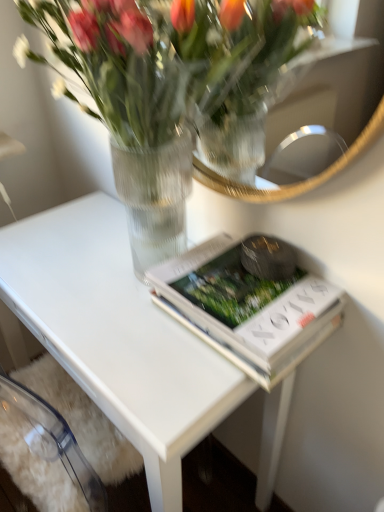
Question: Is white matte book at center outside of clear glass vase at upper center?

Choices:
 (A) yes
 (B) no

Answer: (B)

Question: Is white matte book at center positioned before clear glass vase at upper center?

Choices:
 (A) no
 (B) yes

Answer: (A)

Question: Does white matte book at center have a greater height compared to clear glass vase at upper center?

Choices:
 (A) yes
 (B) no

Answer: (B)

Question: Is white matte book at center beside clear glass vase at upper center?

Choices:
 (A) no
 (B) yes

Answer: (A)

Question: Is the position of white matte book at center more distant than that of clear glass vase at upper center?

Choices:
 (A) no
 (B) yes

Answer: (B)

Question: From the image's perspective, is clear glass vase at upper center positioned above or below white glossy table at center?

Choices:
 (A) below
 (B) above

Answer: (B)

Question: Does point [221, 166] appear closer or farther from the camera than point [127, 374]?

Choices:
 (A) farther
 (B) closer

Answer: (A)

Question: Do you think clear glass vase at upper center is within white glossy table at center, or outside of it?

Choices:
 (A) inside
 (B) outside

Answer: (B)

Question: In terms of width, does clear glass vase at upper center look wider or thinner when compared to white glossy table at center?

Choices:
 (A) thin
 (B) wide

Answer: (A)

Question: From the image's perspective, is clear glass vase at upper center positioned above or below white matte book at center?

Choices:
 (A) below
 (B) above

Answer: (B)

Question: Is clear glass vase at upper center spatially inside white matte book at center, or outside of it?

Choices:
 (A) inside
 (B) outside

Answer: (B)

Question: From a real-world perspective, is clear glass vase at upper center positioned above or below white matte book at center?

Choices:
 (A) above
 (B) below

Answer: (A)

Question: In terms of width, does clear glass vase at upper center look wider or thinner when compared to white matte book at center?

Choices:
 (A) wide
 (B) thin

Answer: (A)

Question: From a real-world perspective, is white matte book at center physically located above or below clear glass vase at upper center?

Choices:
 (A) below
 (B) above

Answer: (A)

Question: Relative to clear glass vase at upper center, is white matte book at center in front or behind?

Choices:
 (A) front
 (B) behind

Answer: (B)